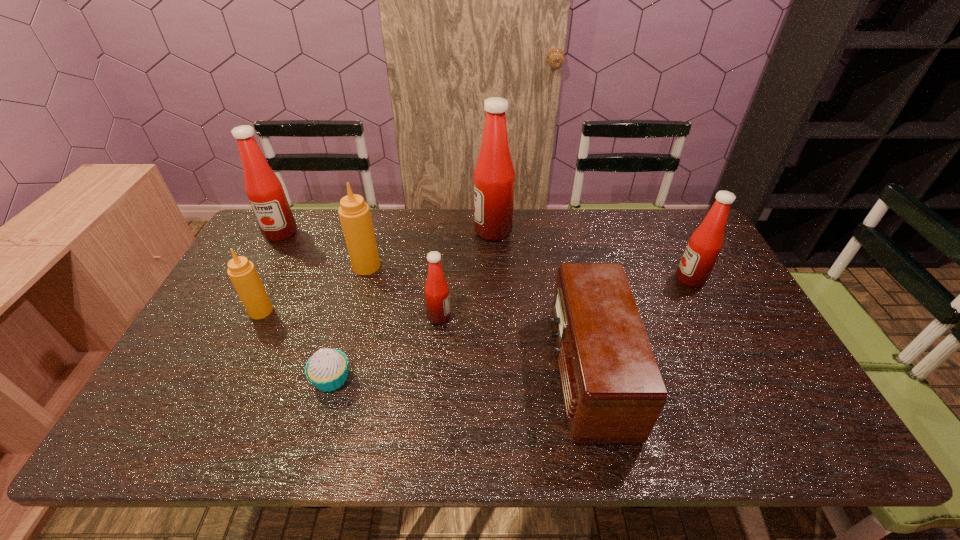
You are a GUI agent. You are given a task and a screenshot of the screen. Output one action in this format:
    pyautogui.click(x=<x>, y=<y>)
    Task: Click on the free area in between the white cupcake and the third biggest red condiment
    
    Given the screenshot: What is the action you would take?
    pyautogui.click(x=511, y=329)

Find the location of `unoccupied area between the fourth object from right to left and the nearer tan condiment`. unoccupied area between the fourth object from right to left and the nearer tan condiment is located at coordinates (350, 314).

You are a GUI agent. You are given a task and a screenshot of the screen. Output one action in this format:
    pyautogui.click(x=<x>, y=<y>)
    Task: Click on the free space between the second object from right to left and the left tan condiment
    The width and height of the screenshot is (960, 540).
    Given the screenshot: What is the action you would take?
    [x=424, y=341]

Where is `free space between the rightmost object and the sixth object from left to right`? The width and height of the screenshot is (960, 540). free space between the rightmost object and the sixth object from left to right is located at coordinates (591, 255).

Where is `object that is the fifth nearest to the fifth condiment from left to right`? The image size is (960, 540). object that is the fifth nearest to the fifth condiment from left to right is located at coordinates (327, 369).

Locate which object is the fourth closest to the rightmost object. Please provide its 2D coordinates. Your answer should be formatted as a tuple, i.e. [(x, y)], where the tuple contains the x and y coordinates of a point satisfying the conditions above.

[(354, 213)]

Point out which condiment is positioned as the fourth nearest to the third red condiment from right to left. Please provide its 2D coordinates. Your answer should be formatted as a tuple, i.e. [(x, y)], where the tuple contains the x and y coordinates of a point satisfying the conditions above.

[(264, 190)]

Image resolution: width=960 pixels, height=540 pixels. Identify the location of condiment that is the closest to the second red condiment from left to right. (354, 213).

Identify which red condiment is the nearest to the nearest red condiment. Please provide its 2D coordinates. Your answer should be formatted as a tuple, i.e. [(x, y)], where the tuple contains the x and y coordinates of a point satisfying the conditions above.

[(494, 176)]

The width and height of the screenshot is (960, 540). I want to click on red condiment identified as the third closest to the left tan condiment, so click(494, 176).